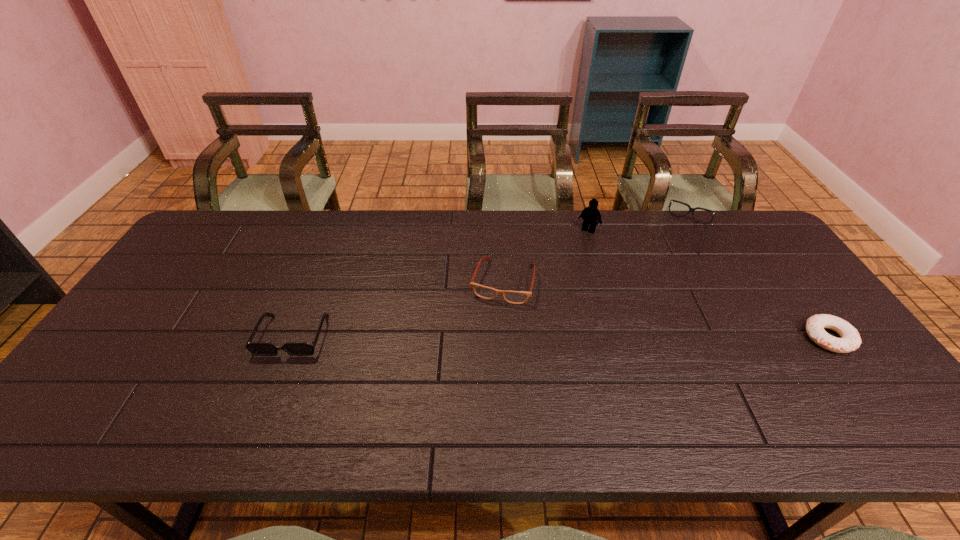
Identify the location of the leftmost object. Image resolution: width=960 pixels, height=540 pixels. (258, 349).

Image resolution: width=960 pixels, height=540 pixels. What are the coordinates of `the rightmost object` in the screenshot? It's located at (850, 340).

Locate an element on the screen. The width and height of the screenshot is (960, 540). doughnut is located at coordinates (850, 340).

In order to click on the nearer spectacles in this screenshot , I will do `click(515, 297)`.

The height and width of the screenshot is (540, 960). I want to click on the second object from left to right, so click(515, 297).

Identify the location of the third object from right to left. Image resolution: width=960 pixels, height=540 pixels. (590, 214).

In order to click on Lego in this screenshot , I will do click(590, 214).

At what (x,y) coordinates should I click in order to perform the action: click on the farther spectacles. Please return your answer as a coordinate pair (x, y). The height and width of the screenshot is (540, 960). Looking at the image, I should click on (692, 210).

Identify the location of the fourth object from left to right. (692, 210).

Identify the location of free space located on the front-facing side of the sunglasses. The width and height of the screenshot is (960, 540). pos(270,394).